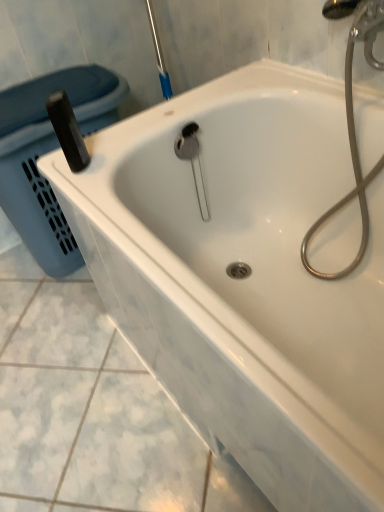
Question: From a real-world perspective, is blue plastic laundry basket at left below metallic silver hose at upper right?

Choices:
 (A) no
 (B) yes

Answer: (B)

Question: Considering the relative sizes of blue plastic laundry basket at left and metallic silver hose at upper right in the image provided, is blue plastic laundry basket at left bigger than metallic silver hose at upper right?

Choices:
 (A) no
 (B) yes

Answer: (B)

Question: Is blue plastic laundry basket at left positioned far away from metallic silver hose at upper right?

Choices:
 (A) no
 (B) yes

Answer: (A)

Question: Considering the relative positions of blue plastic laundry basket at left and metallic silver hose at upper right in the image provided, is blue plastic laundry basket at left to the right of metallic silver hose at upper right from the viewer's perspective?

Choices:
 (A) yes
 (B) no

Answer: (B)

Question: Is blue plastic laundry basket at left at the left side of metallic silver hose at upper right?

Choices:
 (A) no
 (B) yes

Answer: (B)

Question: Is blue plastic laundry basket at left wider than metallic silver hose at upper right?

Choices:
 (A) yes
 (B) no

Answer: (A)

Question: Is blue plastic laundry basket at left at the back of metallic silver hose at upper right?

Choices:
 (A) no
 (B) yes

Answer: (A)

Question: Considering the relative positions of metallic silver hose at upper right and blue plastic laundry basket at left in the image provided, is metallic silver hose at upper right to the right of blue plastic laundry basket at left from the viewer's perspective?

Choices:
 (A) yes
 (B) no

Answer: (A)

Question: From the image's perspective, is metallic silver hose at upper right beneath blue plastic laundry basket at left?

Choices:
 (A) no
 (B) yes

Answer: (B)

Question: Considering the relative sizes of metallic silver hose at upper right and blue plastic laundry basket at left in the image provided, is metallic silver hose at upper right taller than blue plastic laundry basket at left?

Choices:
 (A) no
 (B) yes

Answer: (B)

Question: Is metallic silver hose at upper right positioned behind blue plastic laundry basket at left?

Choices:
 (A) yes
 (B) no

Answer: (B)

Question: Is metallic silver hose at upper right aimed at blue plastic laundry basket at left?

Choices:
 (A) no
 (B) yes

Answer: (A)

Question: Is point (306, 245) closer or farther from the camera than point (61, 262)?

Choices:
 (A) closer
 (B) farther

Answer: (A)